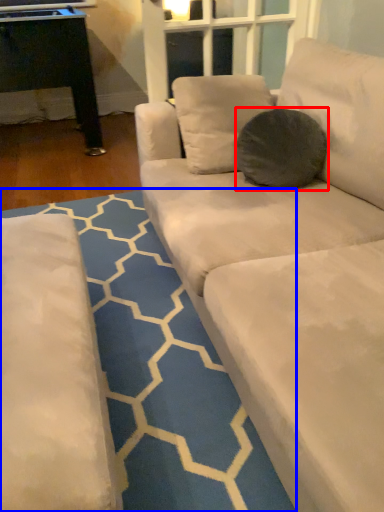
Question: Which point is further to the camera, throw pillow (highlighted by a red box) or pattern (highlighted by a blue box)?

Choices:
 (A) throw pillow
 (B) pattern

Answer: (A)